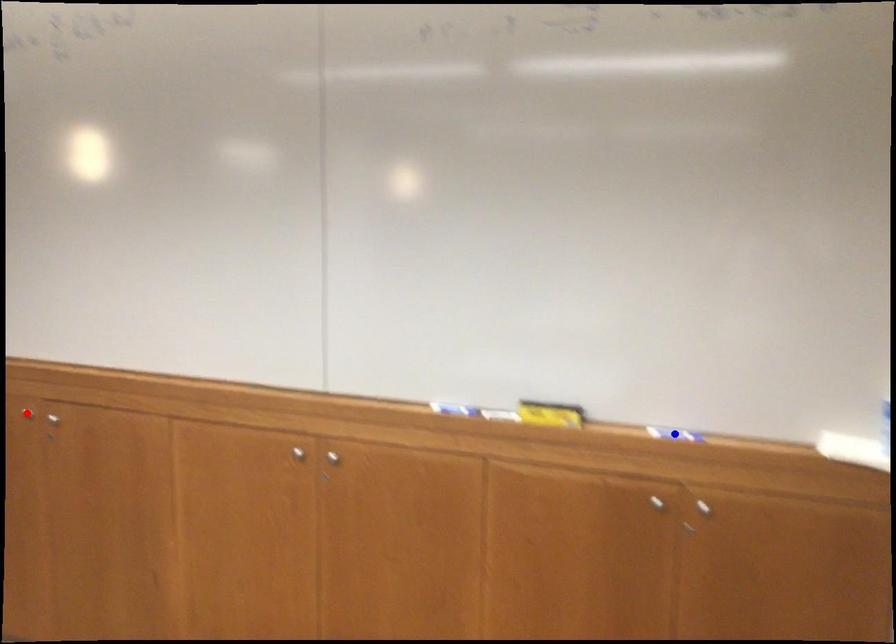
Question: Which of the two points in the image is closer to the camera?

Choices:
 (A) Blue point is closer.
 (B) Red point is closer.

Answer: (A)